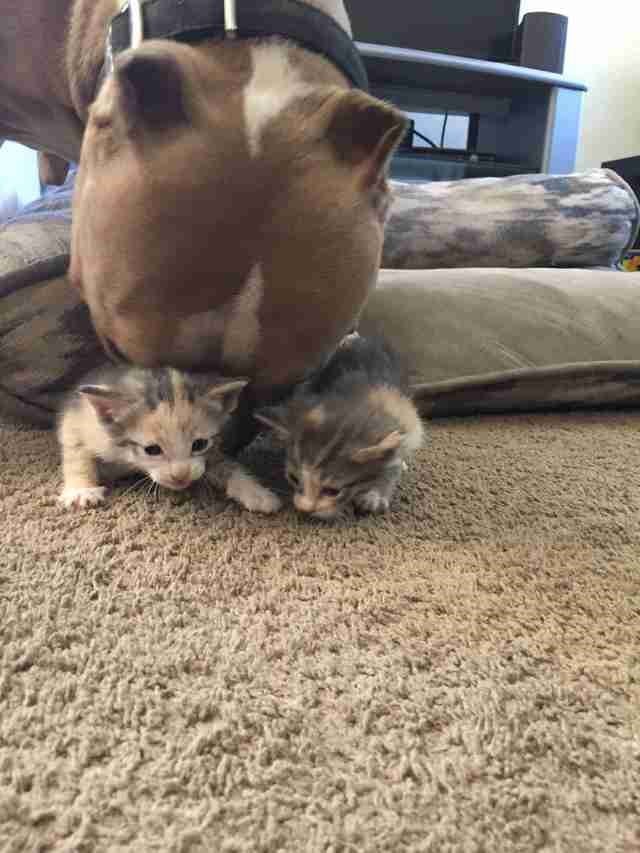
The image size is (640, 853). I want to click on carpet, so click(342, 671).